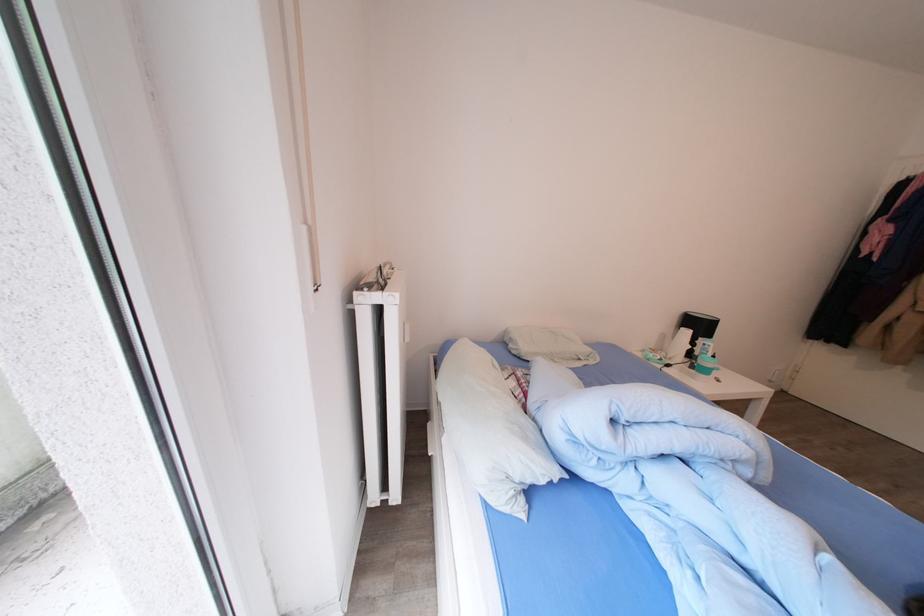
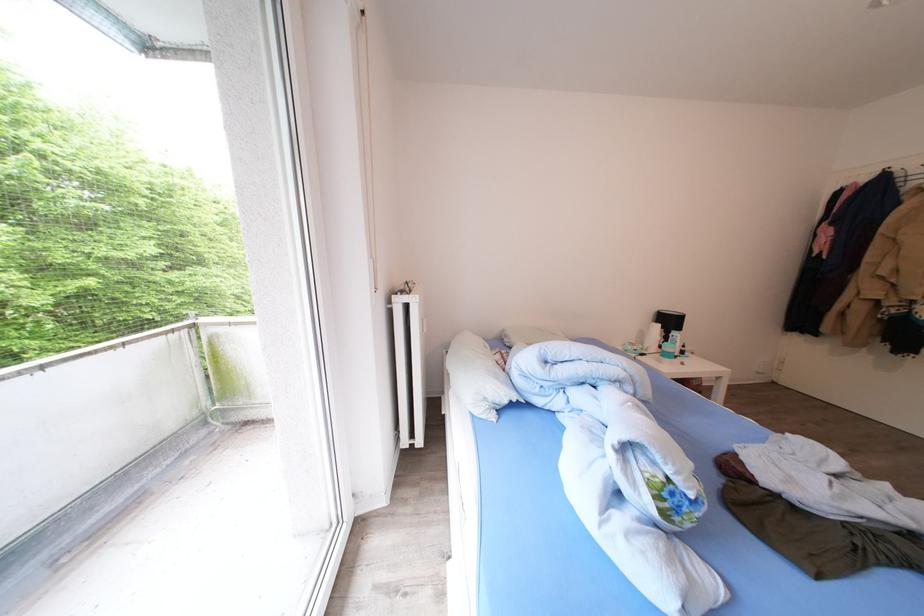
Where in the second image is the point corresponding to (x=416, y=331) from the first image?

(433, 326)